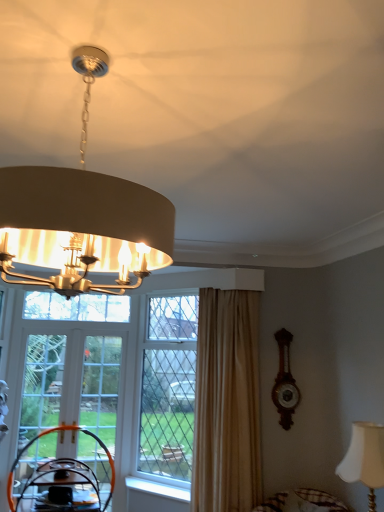
Question: From the image's perspective, would you say white fabric lampshade at lower right, the 1th lamp from the bottom, is positioned over beige fabric curtain at right?

Choices:
 (A) yes
 (B) no

Answer: (B)

Question: From the image's perspective, does white fabric lampshade at lower right, the 1th lamp from the bottom, appear lower than beige fabric curtain at right?

Choices:
 (A) no
 (B) yes

Answer: (B)

Question: Does white fabric lampshade at lower right, which is the first lamp in right-to-left order, appear on the left side of beige fabric curtain at right?

Choices:
 (A) no
 (B) yes

Answer: (A)

Question: Considering the relative sizes of white fabric lampshade at lower right, which is the second lamp from left to right, and beige fabric curtain at right in the image provided, is white fabric lampshade at lower right, which is the second lamp from left to right, wider than beige fabric curtain at right?

Choices:
 (A) no
 (B) yes

Answer: (A)

Question: Is white fabric lampshade at lower right, the second lamp from the front, completely or partially outside of beige fabric curtain at right?

Choices:
 (A) no
 (B) yes

Answer: (B)

Question: From a real-world perspective, is clear glass screen door at center, which is the 1th screen door in right-to-left order, positioned above or below orange plastic swivel chair at lower left?

Choices:
 (A) above
 (B) below

Answer: (A)

Question: Is clear glass screen door at center, placed as the second screen door when sorted from left to right, bigger or smaller than orange plastic swivel chair at lower left?

Choices:
 (A) small
 (B) big

Answer: (B)

Question: In the image, is clear glass screen door at center, which is the 1th screen door in right-to-left order, on the left side or the right side of orange plastic swivel chair at lower left?

Choices:
 (A) left
 (B) right

Answer: (B)

Question: Looking at their shapes, would you say clear glass screen door at center, which is the 1th screen door in right-to-left order, is wider or thinner than orange plastic swivel chair at lower left?

Choices:
 (A) thin
 (B) wide

Answer: (B)

Question: Visually, is beige fabric curtain at right positioned to the left or to the right of orange plastic swivel chair at lower left?

Choices:
 (A) right
 (B) left

Answer: (A)

Question: From a real-world perspective, is beige fabric curtain at right positioned above or below orange plastic swivel chair at lower left?

Choices:
 (A) above
 (B) below

Answer: (A)

Question: Considering the positions of beige fabric curtain at right and orange plastic swivel chair at lower left in the image, is beige fabric curtain at right taller or shorter than orange plastic swivel chair at lower left?

Choices:
 (A) short
 (B) tall

Answer: (B)

Question: In the image, is beige fabric curtain at right positioned in front of or behind orange plastic swivel chair at lower left?

Choices:
 (A) behind
 (B) front

Answer: (B)

Question: Relative to white fabric lampshade at lower right, the 1th lamp from the bottom, is white painted wood at lower center in front or behind?

Choices:
 (A) behind
 (B) front

Answer: (A)

Question: From a real-world perspective, is white painted wood at lower center positioned above or below white fabric lampshade at lower right, which is the second lamp from left to right?

Choices:
 (A) below
 (B) above

Answer: (A)